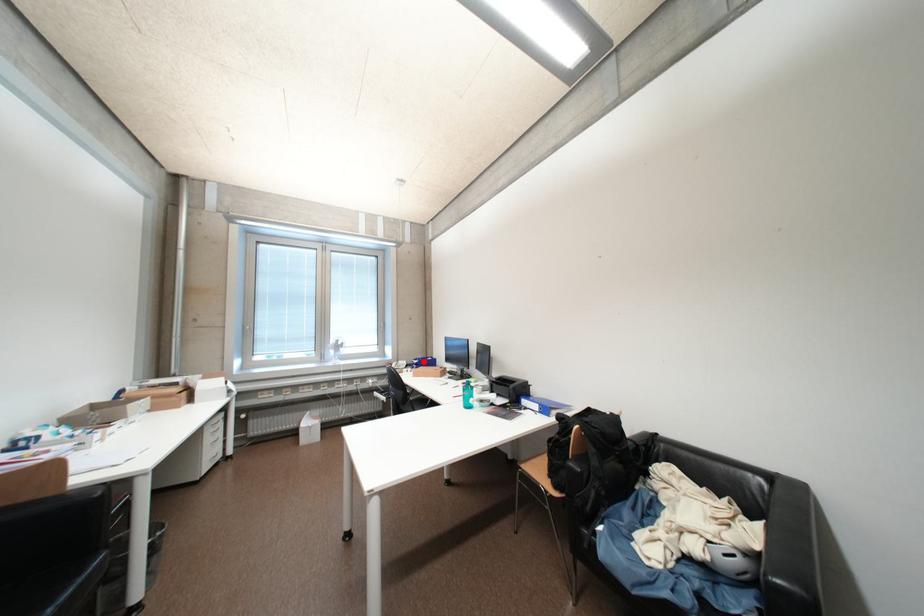
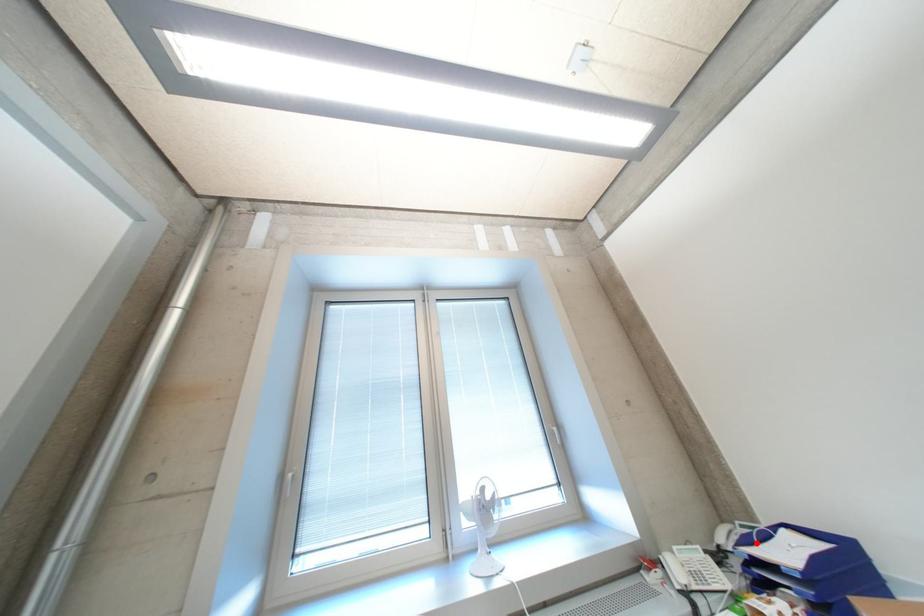
Based on the photo, I am providing you with two images of the same scene from different viewpoints. A red point is marked on the first image and another point is marked on the second image. Are the points marked in image1 and image2 representing the same 3D position?

Yes